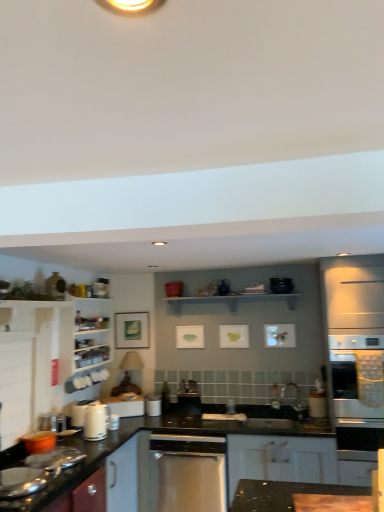
Question: Does white glossy cabinet at left, which ranks as the first cabinetry in top-to-bottom order, have a greater width compared to satin stainless steel dishwasher at center?

Choices:
 (A) yes
 (B) no

Answer: (B)

Question: Is white glossy cabinet at left, the 1th cabinetry positioned from the left, behind satin stainless steel dishwasher at center?

Choices:
 (A) yes
 (B) no

Answer: (A)

Question: Is white glossy cabinet at left, which ranks as the first cabinetry in top-to-bottom order, bigger than satin stainless steel dishwasher at center?

Choices:
 (A) yes
 (B) no

Answer: (B)

Question: Could you tell me if white glossy cabinet at left, which is the 2th cabinetry from bottom to top, is turned towards satin stainless steel dishwasher at center?

Choices:
 (A) yes
 (B) no

Answer: (B)

Question: From the image's perspective, would you say white glossy cabinet at left, which ranks as the first cabinetry in top-to-bottom order, is shown under satin stainless steel dishwasher at center?

Choices:
 (A) yes
 (B) no

Answer: (B)

Question: Is satin stainless steel dishwasher at center a part of white glossy cabinet at left, which is counted as the 2th cabinetry, starting from the right?

Choices:
 (A) no
 (B) yes

Answer: (A)

Question: Can you confirm if white glossy cabinet at left, which is counted as the 2th cabinetry, starting from the right, is bigger than white matte cabinet at lower center, which is the 2th cabinetry from top to bottom?

Choices:
 (A) yes
 (B) no

Answer: (B)

Question: From the image's perspective, is white glossy cabinet at left, which is counted as the 2th cabinetry, starting from the right, on white matte cabinet at lower center, which ranks as the 1th cabinetry in bottom-to-top order?

Choices:
 (A) yes
 (B) no

Answer: (A)

Question: From the image's perspective, is white glossy cabinet at left, the 1th cabinetry positioned from the left, located beneath white matte cabinet at lower center, which is the 2th cabinetry from top to bottom?

Choices:
 (A) yes
 (B) no

Answer: (B)

Question: Is white glossy cabinet at left, the 1th cabinetry positioned from the left, to the left of white matte cabinet at lower center, which is the 2th cabinetry from top to bottom, from the viewer's perspective?

Choices:
 (A) yes
 (B) no

Answer: (A)

Question: Are white glossy cabinet at left, which is counted as the 2th cabinetry, starting from the right, and white matte cabinet at lower center, the 1th cabinetry positioned from the right, beside each other?

Choices:
 (A) yes
 (B) no

Answer: (B)

Question: Is white glossy cabinet at left, the 1th cabinetry positioned from the left, surrounding white matte cabinet at lower center, which is the 2th cabinetry from top to bottom?

Choices:
 (A) no
 (B) yes

Answer: (A)

Question: From a real-world perspective, is white wooden shelf at upper center positioned under black glossy countertop at lower left, which is the 1th countertop in back-to-front order, based on gravity?

Choices:
 (A) no
 (B) yes

Answer: (A)